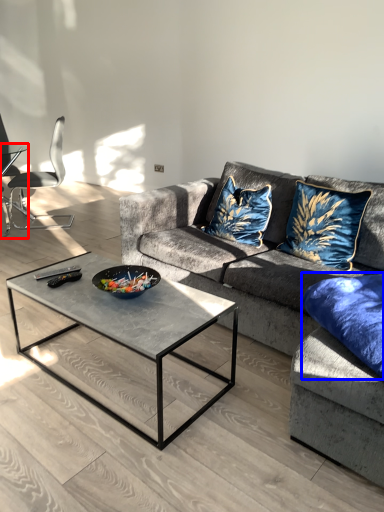
Question: Among these objects, which one is nearest to the camera, coffee table (highlighted by a red box) or pillow (highlighted by a blue box)?

Choices:
 (A) coffee table
 (B) pillow

Answer: (B)